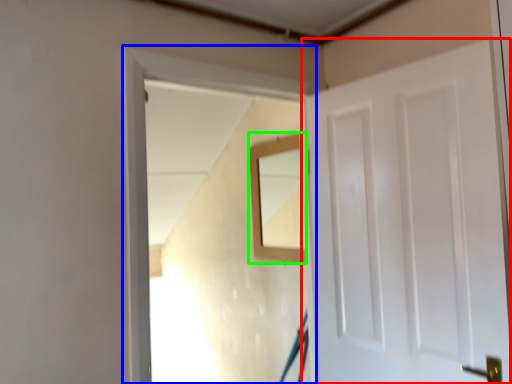
Question: Which is nearer to the door (highlighted by a red box)? window frame (highlighted by a blue box) or mirror (highlighted by a green box).

Choices:
 (A) window frame
 (B) mirror

Answer: (A)